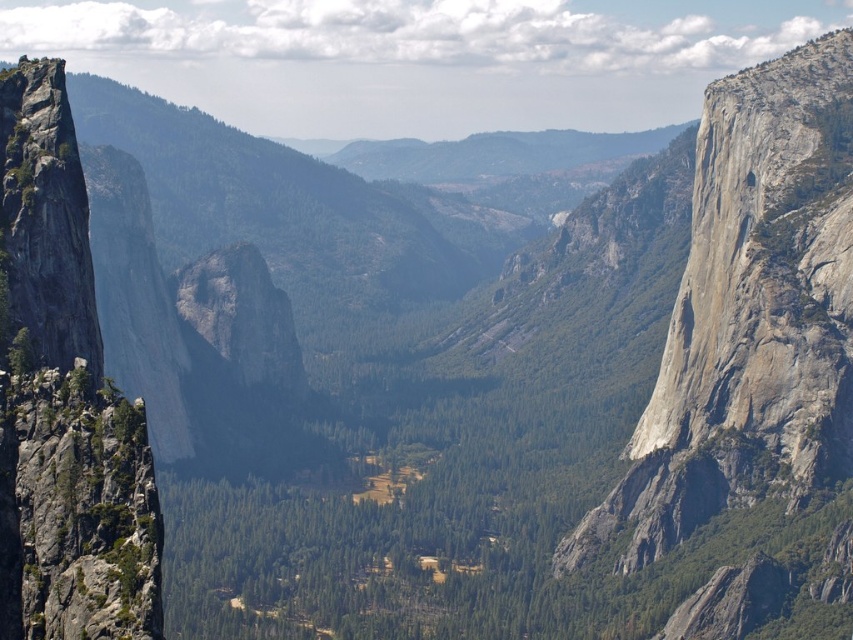
Question: Does gray/rough rock at right have a smaller size compared to gray/rough rock formation at left?

Choices:
 (A) no
 (B) yes

Answer: (A)

Question: Does gray/rough rock at right appear on the right side of gray/rough rock formation at left?

Choices:
 (A) yes
 (B) no

Answer: (A)

Question: Which point appears farthest from the camera in this image?

Choices:
 (A) (51, 243)
 (B) (694, 433)

Answer: (B)

Question: Which object is closer to the camera taking this photo?

Choices:
 (A) gray/rough rock formation at left
 (B) gray/rough rock at right

Answer: (A)

Question: Can you confirm if gray/rough rock at right is positioned above gray/rough rock formation at left?

Choices:
 (A) no
 (B) yes

Answer: (B)

Question: Which object is farther from the camera taking this photo?

Choices:
 (A) gray/rough rock formation at left
 (B) gray/rough rock at right

Answer: (B)